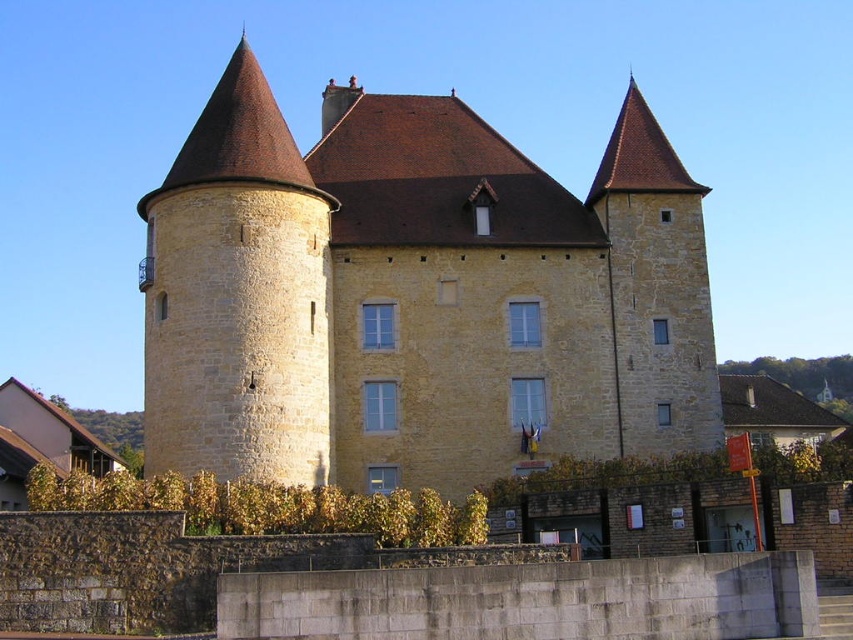
Does yellow stone castle at center have a larger size compared to yellow stone tower at left?

Incorrect, yellow stone castle at center is not larger than yellow stone tower at left.

Is point (428, 412) farther from camera compared to point (265, 214)?

Yes, it is behind point (265, 214).

Does point (433, 300) lie in front of point (280, 264)?

No, it is not.

Locate an element on the screen. The image size is (853, 640). yellow stone castle at center is located at coordinates (416, 296).